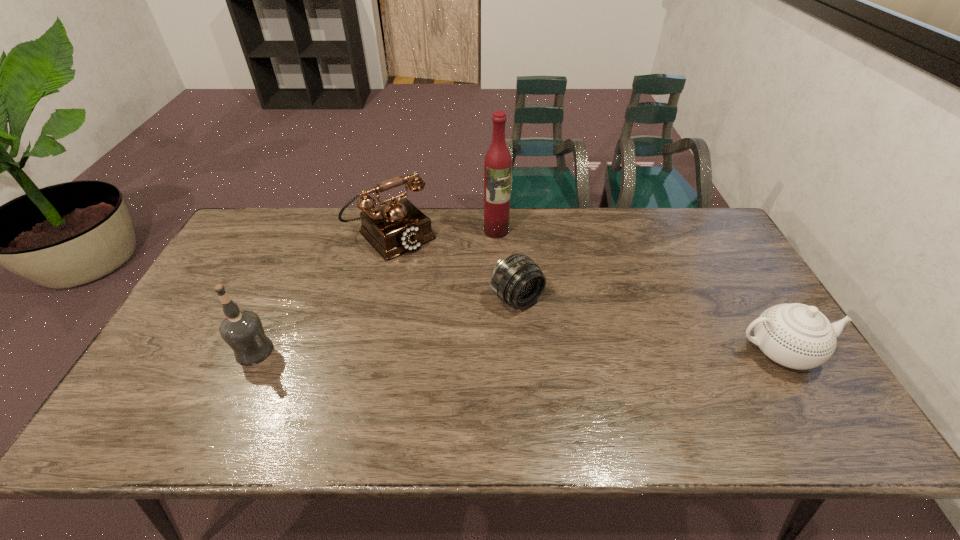
The image size is (960, 540). I want to click on vacant space that's between the chinaware and the fourth object from right to left, so click(586, 293).

Locate an element on the screen. empty space that is in between the shortest object and the fourth tallest object is located at coordinates (648, 325).

The image size is (960, 540). In order to click on unoccupied area between the tallest object and the second object from left to right in this screenshot , I will do `click(444, 233)`.

At what (x,y) coordinates should I click in order to perform the action: click on vacant space in between the rightmost object and the tallest object. Please return your answer as a coordinate pair (x, y). This screenshot has height=540, width=960. Looking at the image, I should click on (637, 291).

Locate an element on the screen. free spot between the fourth tallest object and the telephone is located at coordinates (586, 293).

Where is `empty location between the rightmost object and the liquor`? The width and height of the screenshot is (960, 540). empty location between the rightmost object and the liquor is located at coordinates (637, 291).

This screenshot has height=540, width=960. I want to click on free space between the telephoto lens and the vodka, so click(x=385, y=325).

Select which object appears as the fourth closest to the telephoto lens. Please provide its 2D coordinates. Your answer should be formatted as a tuple, i.e. [(x, y)], where the tuple contains the x and y coordinates of a point satisfying the conditions above.

[(242, 330)]

Select which object is the third closest to the tallest object. Please provide its 2D coordinates. Your answer should be formatted as a tuple, i.e. [(x, y)], where the tuple contains the x and y coordinates of a point satisfying the conditions above.

[(798, 336)]

Where is `vacant region that satisfies the following two spatial constraints: 1. on the front side of the chinaware; 2. on the spout of the shortest object`? This screenshot has width=960, height=540. vacant region that satisfies the following two spatial constraints: 1. on the front side of the chinaware; 2. on the spout of the shortest object is located at coordinates (521, 352).